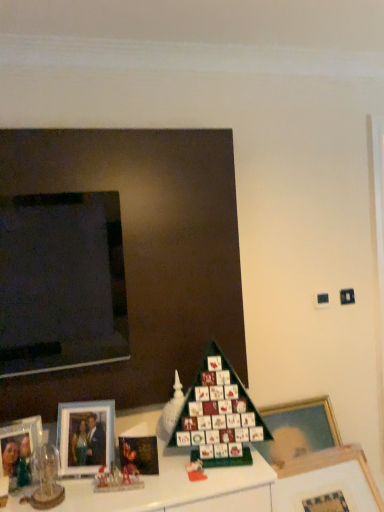
This screenshot has width=384, height=512. Identify the location of vacant position to the left of green cardboard christmas tree at center. (151, 483).